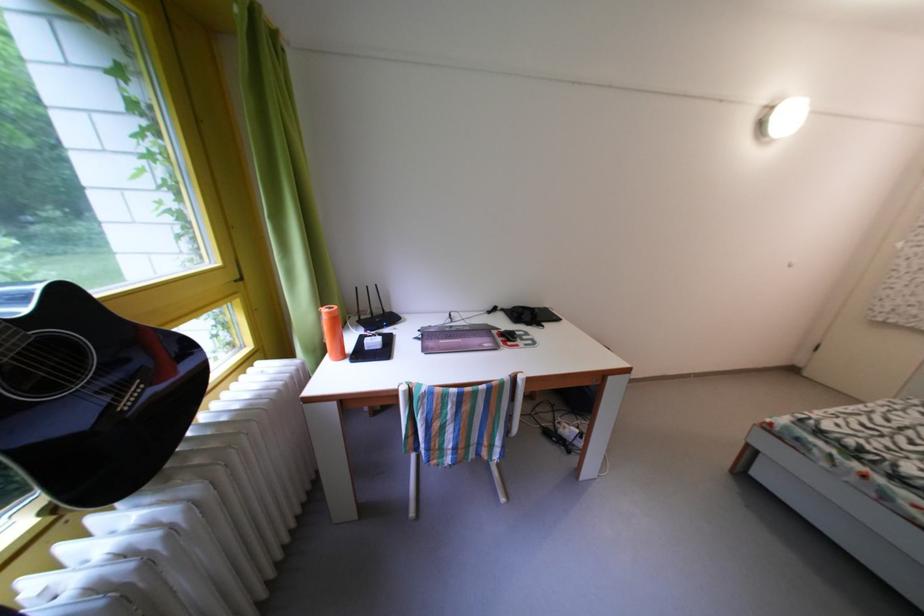
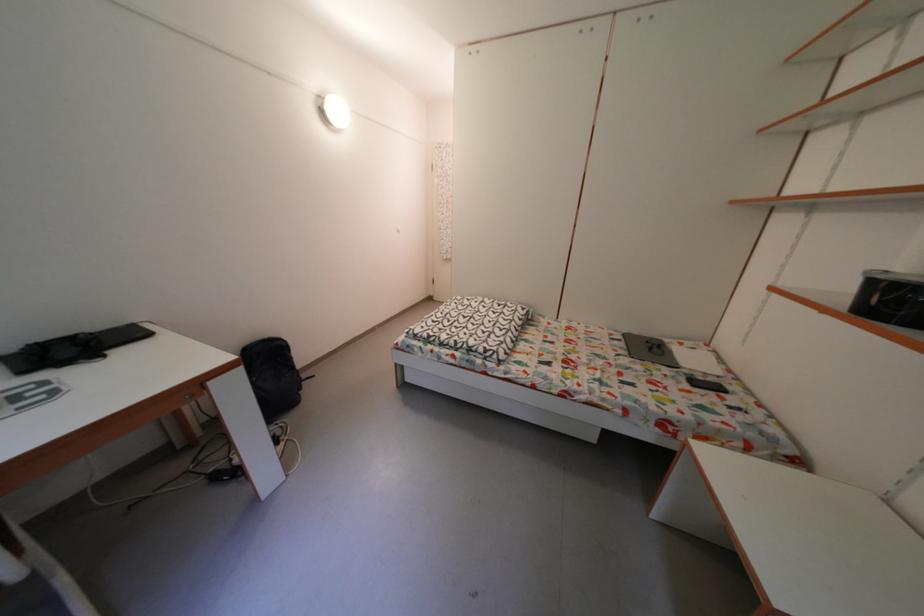
Locate, in the second image, the point that corresponds to [512,315] in the first image.

(6, 363)